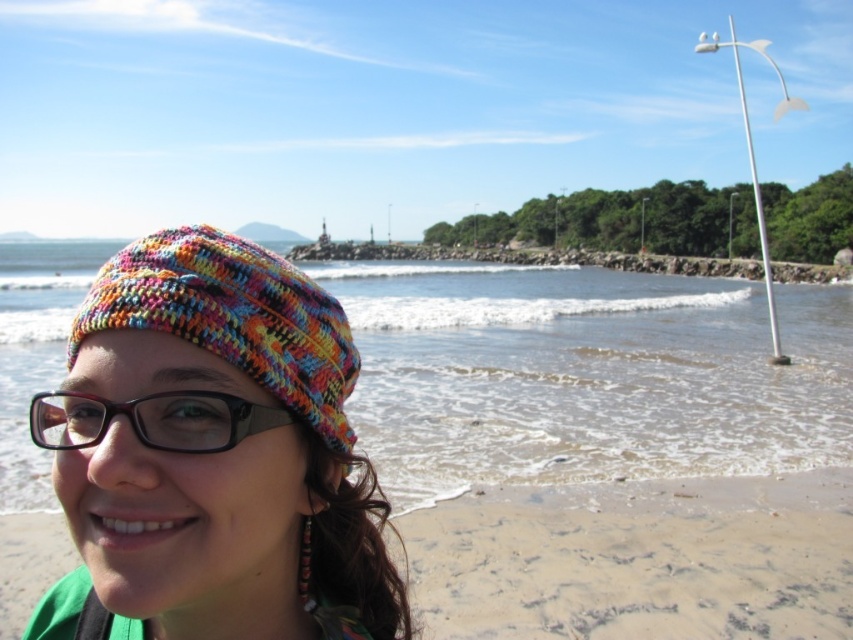
You are a photographer standing on the beige sandy beach at lower left and want to take a photo of the clear water at lower left. Which object is closer to your camera lens?

The clear water at lower left is closer to the camera lens because it is further to the viewer than the beige sandy beach at lower left.

You are standing on the beige sandy beach at lower left and want to reach the clear water at lower left. Which direction should you move to get there?

You should move to the left because the clear water at lower left is to the left of the beige sandy beach at lower left.

You are a swimmer planning to enter the water. You see the clear water at lower left and the beige sandy beach at lower left. Which area has a bigger space for you to swim in?

The clear water at lower left has a larger size compared to the beige sandy beach at lower left, so the clear water at lower left offers a bigger space for swimming.